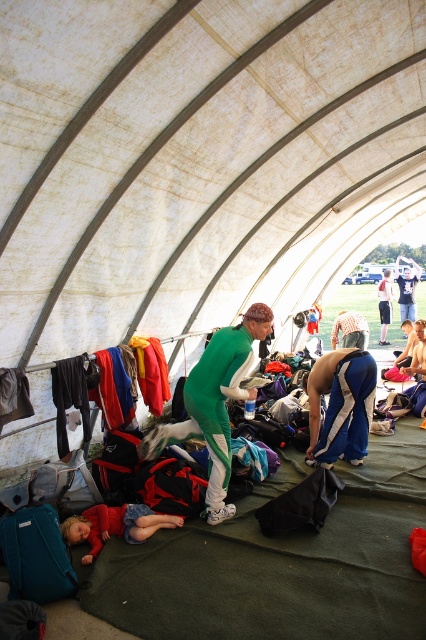
Question: Which object is closer to the camera taking this photo?

Choices:
 (A) green fabric person at center
 (B) green spandex suit at center
 (C) shiny metallic helmet at center

Answer: (B)

Question: Which object is farther from the camera taking this photo?

Choices:
 (A) green spandex suit at center
 (B) blue denim shorts at center
 (C) shiny metallic helmet at center

Answer: (B)

Question: Which of the following is the farthest from the observer?

Choices:
 (A) green spandex suit at center
 (B) blue denim shorts at center
 (C) matte red dress at lower left

Answer: (B)

Question: Can you confirm if teal fabric backpack at lower left is positioned to the left of shiny metallic helmet at center?

Choices:
 (A) yes
 (B) no

Answer: (A)

Question: Does blue denim shorts at center have a larger size compared to shiny metallic helmet at center?

Choices:
 (A) yes
 (B) no

Answer: (A)

Question: Is teal fabric backpack at lower left bigger than green fabric person at center?

Choices:
 (A) no
 (B) yes

Answer: (A)